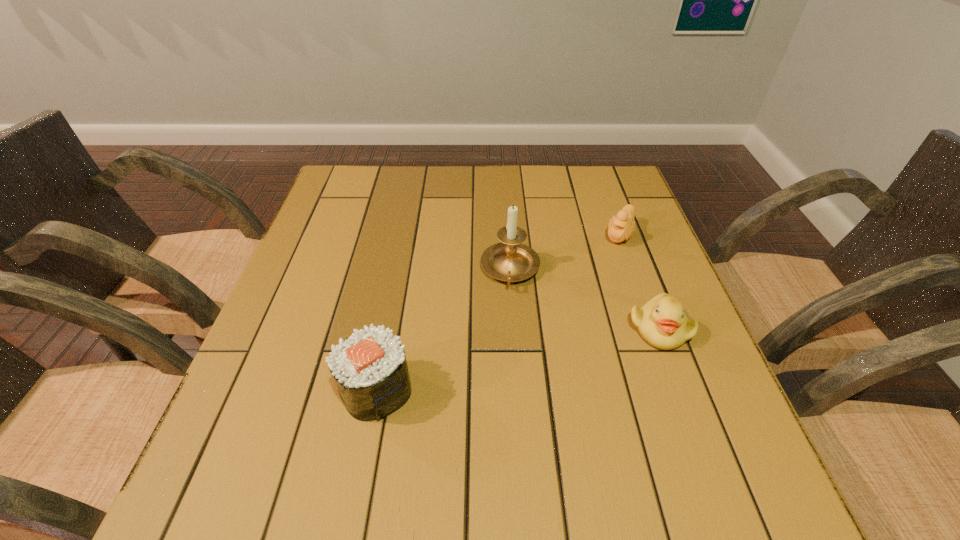
Find the location of `vacant region located on the face of the farther duckling`. vacant region located on the face of the farther duckling is located at coordinates (605, 268).

You are a GUI agent. You are given a task and a screenshot of the screen. Output one action in this format:
    pyautogui.click(x=<x>, y=<y>)
    Task: Click on the free space located 0.250m with a handle on the side of the second object from left to right
    Image resolution: width=960 pixels, height=540 pixels.
    Given the screenshot: What is the action you would take?
    pyautogui.click(x=512, y=394)

Where is `free region located 0.150m with a handle on the side of the second object from left to right`? free region located 0.150m with a handle on the side of the second object from left to right is located at coordinates (512, 349).

At what (x,y) coordinates should I click in order to perform the action: click on vacant space located 0.350m with a handle on the side of the second object from left to right. Please return your answer as a coordinate pair (x, y). Looking at the image, I should click on (513, 446).

This screenshot has height=540, width=960. Identify the location of object that is positioned at the near edge. (370, 369).

This screenshot has height=540, width=960. Identify the location of vacant space at the far edge of the desktop. (432, 179).

Where is `free region at the near edge of the desktop`? The height and width of the screenshot is (540, 960). free region at the near edge of the desktop is located at coordinates (505, 415).

The width and height of the screenshot is (960, 540). In the image, there is a desktop. In order to click on vacant region at the right edge in this screenshot , I will do `click(627, 301)`.

Locate an element on the screen. The width and height of the screenshot is (960, 540). free space at the far left corner is located at coordinates (345, 182).

I want to click on free region at the near right corner of the desktop, so click(x=660, y=414).